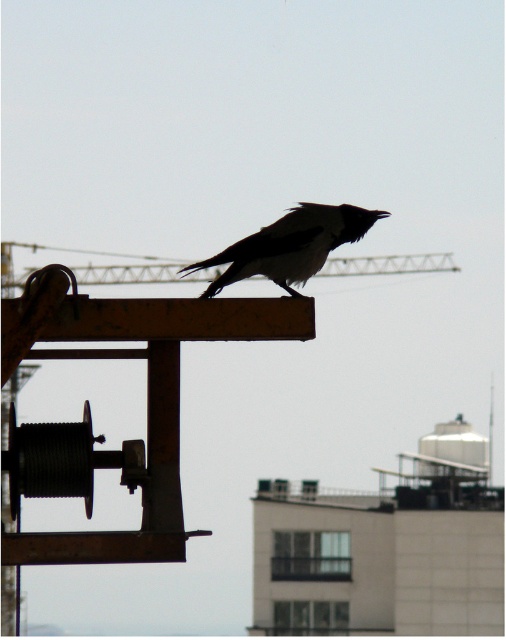
Looking at this image, you are an engineer inspecting a construction site. You notice a black matte bird at center and a metallic gray crane at center. Which object is located above the other?

The metallic gray crane at center is above the black matte bird at center because the black matte bird at center is positioned under it.

You are a photographer trying to capture a clear shot of the metallic gray crane at center. However, the black matte bird at center is blocking your view. Can you determine if the bird is in front of or behind the crane?

The metallic gray crane at center is behind the black matte bird at center, so the bird is blocking the crane from view.